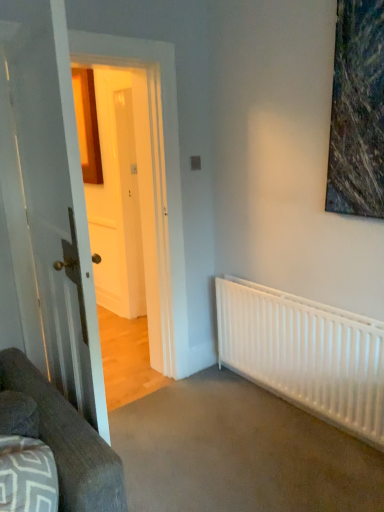
Image resolution: width=384 pixels, height=512 pixels. I want to click on white matte radiator at lower right, so click(x=305, y=354).

I want to click on white matte radiator at lower right, so click(305, 354).

Is white glossy door at left at the back of dark gray fabric couch at lower left?

No, dark gray fabric couch at lower left's orientation is not away from white glossy door at left.

Is dark gray fabric couch at lower left wider or thinner than white glossy door at left?

In the image, dark gray fabric couch at lower left appears to be wider than white glossy door at left.

From a real-world perspective, which object stands above the other?

white glossy door at left, from a real-world perspective.

From the picture: Is dark gray fabric couch at lower left in front of white glossy door at left?

Yes, the depth of dark gray fabric couch at lower left is less than that of white glossy door at left.

Is white glossy door at left wider than dark gray fabric couch at lower left?

Incorrect, the width of white glossy door at left does not surpass that of dark gray fabric couch at lower left.

In terms of height, does white glossy door at left look taller or shorter compared to dark gray fabric couch at lower left?

In the image, white glossy door at left appears to be taller than dark gray fabric couch at lower left.

Relative to dark gray fabric couch at lower left, is white glossy door at left in front or behind?

Visually, white glossy door at left is located behind dark gray fabric couch at lower left.

Is white glossy door at left bigger or smaller than dark gray fabric couch at lower left?

white glossy door at left is bigger than dark gray fabric couch at lower left.

From the image's perspective, which object appears higher, white glossy door at left or white matte radiator at lower right?

white glossy door at left appears higher in the image.

Considering the sizes of objects white glossy door at left and white matte radiator at lower right in the image provided, who is bigger, white glossy door at left or white matte radiator at lower right?

Bigger between the two is white glossy door at left.

In the scene shown: Is white glossy door at left not close to white matte radiator at lower right?

Yes, white glossy door at left and white matte radiator at lower right are located far from each other.

Considering the relative positions of white matte radiator at lower right and white glossy door at left in the image provided, is white matte radiator at lower right to the left of white glossy door at left from the viewer's perspective?

Incorrect, white matte radiator at lower right is not on the left side of white glossy door at left.

From a real-world perspective, relative to white glossy door at left, is white matte radiator at lower right vertically above or below?

From a real-world perspective, white matte radiator at lower right is physically below white glossy door at left.

Considering the relative sizes of white matte radiator at lower right and white glossy door at left in the image provided, is white matte radiator at lower right taller than white glossy door at left?

In fact, white matte radiator at lower right may be shorter than white glossy door at left.

Is white matte radiator at lower right outside of white glossy door at left?

white matte radiator at lower right is positioned outside white glossy door at left.

Which object is positioned more to the left, dark gray fabric couch at lower left or white matte radiator at lower right?

dark gray fabric couch at lower left is more to the left.

Which point is more distant from viewer, (x=87, y=510) or (x=359, y=366)?

Point (x=359, y=366)

Between dark gray fabric couch at lower left and white matte radiator at lower right, which one is positioned behind?

white matte radiator at lower right.

Can you confirm if dark gray fabric couch at lower left is thinner than white matte radiator at lower right?

Incorrect, the width of dark gray fabric couch at lower left is not less than that of white matte radiator at lower right.

Is point (278, 330) closer to viewer compared to point (81, 456)?

No.

Could you tell me if white matte radiator at lower right is facing dark gray fabric couch at lower left?

Yes, white matte radiator at lower right is facing dark gray fabric couch at lower left.

Between white matte radiator at lower right and dark gray fabric couch at lower left, which one has smaller size?

dark gray fabric couch at lower left is smaller.

This screenshot has height=512, width=384. In order to click on studio couch above the white matte radiator at lower right (from a real-world perspective) in this screenshot , I will do `click(69, 442)`.

The image size is (384, 512). Find the location of `studio couch on the right of white glossy door at left`. studio couch on the right of white glossy door at left is located at coordinates (69, 442).

Where is `door that appears on the left of dark gray fabric couch at lower left`? The image size is (384, 512). door that appears on the left of dark gray fabric couch at lower left is located at coordinates (57, 207).

Looking at the image, which one is located further to dark gray fabric couch at lower left, white glossy door at left or white matte radiator at lower right?

white matte radiator at lower right is positioned further to the anchor dark gray fabric couch at lower left.

From the image, which object appears to be nearer to white glossy door at left, dark gray fabric couch at lower left or white matte radiator at lower right?

Among the two, dark gray fabric couch at lower left is located nearer to white glossy door at left.

From the image, which object appears to be farther from white glossy door at left, white matte radiator at lower right or dark gray fabric couch at lower left?

The object further to white glossy door at left is white matte radiator at lower right.

When comparing their distances from dark gray fabric couch at lower left, does white matte radiator at lower right or white glossy door at left seem further?

white matte radiator at lower right is positioned further to the anchor dark gray fabric couch at lower left.

Which object lies nearer to the anchor point white matte radiator at lower right, white glossy door at left or dark gray fabric couch at lower left?

Based on the image, white glossy door at left appears to be nearer to white matte radiator at lower right.

Considering their positions, is dark gray fabric couch at lower left positioned further to white matte radiator at lower right than white glossy door at left?

The object further to white matte radiator at lower right is dark gray fabric couch at lower left.

Where is `studio couch between white glossy door at left and white matte radiator at lower right in the horizontal direction`? The image size is (384, 512). studio couch between white glossy door at left and white matte radiator at lower right in the horizontal direction is located at coordinates (69, 442).